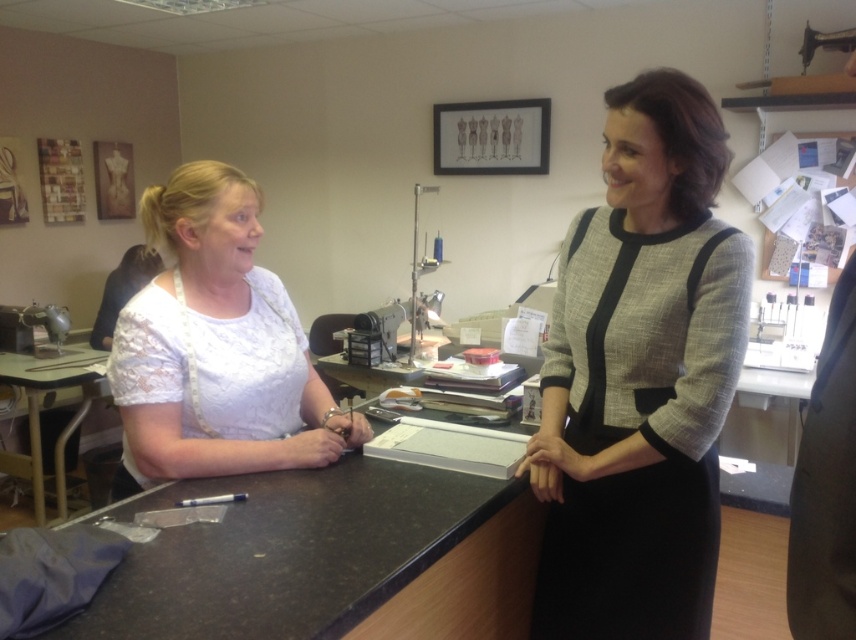
You are standing in the studio and want to hand a fabric sample to the person closest to you. The fabric sample is on the matte gray dress at center. Which direction should you move to reach it?

The matte gray dress at center is positioned closest to you since its distance from the camera is 4.03 feet, so you should move forward towards the matte gray dress at center to reach it.

You are standing at the point labeled point (34, 424) and want to walk to the door on the opposite side of the room. There is an obstacle at point (562, 628). Will you need to go around it?

Yes, you will need to go around the obstacle at point (562, 628) because it is in front of your current position at point (34, 424).

You are a customer in the studio and want to hand a document to the woman wearing the white lace blouse at left. Where should you approach from to ensure she can easily reach the document without having to turn around?

You should approach from the left side of the white lace blouse at left since the white lace blouse at left is positioned at point [217,348], which is on the left side of the counter. This allows the customer to hand the document directly within her reach without requiring her to turn around.